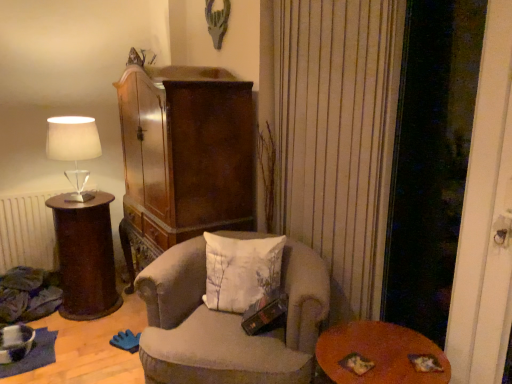
This screenshot has width=512, height=384. I want to click on free spot below white fabric lampshade at left (from a real-world perspective), so click(78, 196).